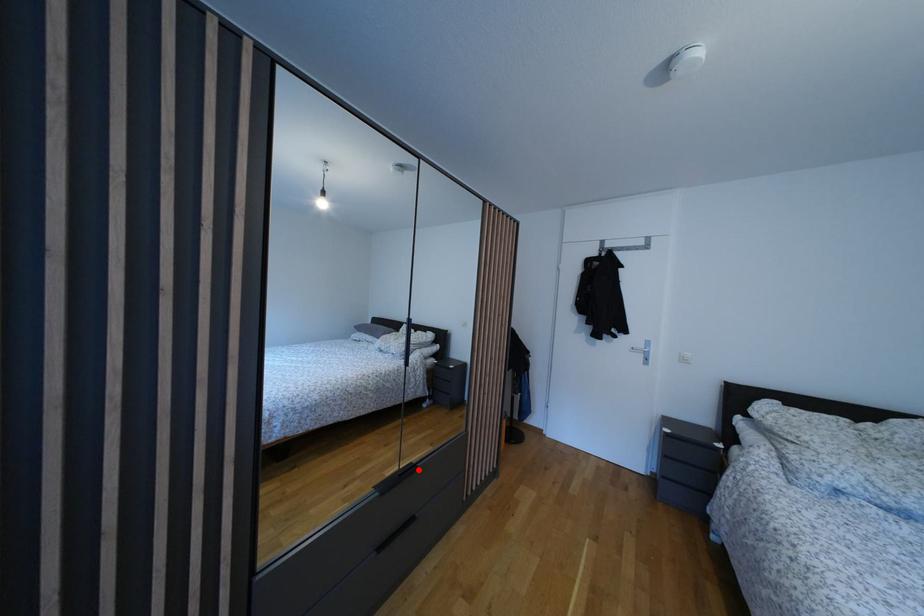
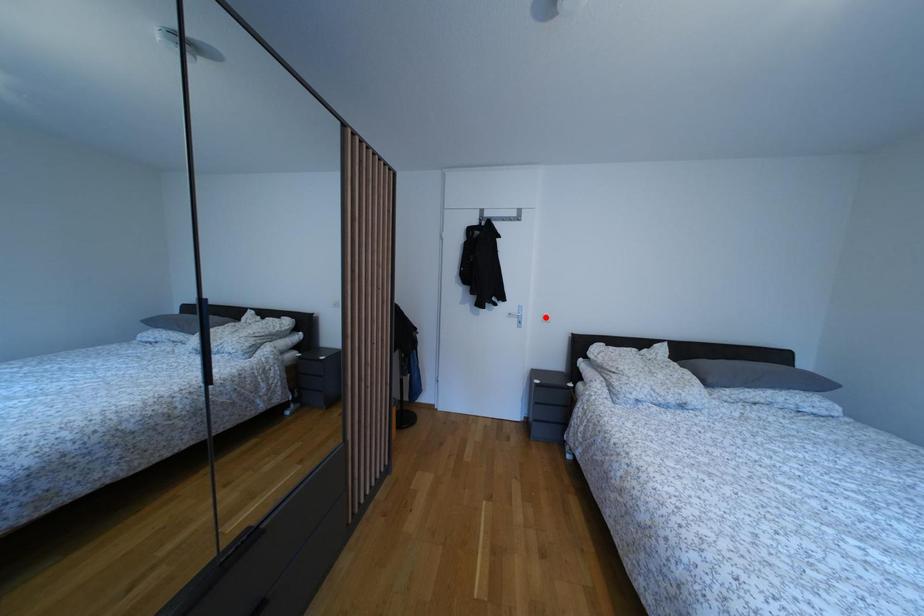
From the picture: I am providing you with two images of the same scene from different viewpoints. A red point is marked on the first image and another point is marked on the second image. Are the points marked in image1 and image2 representing the same 3D position?

No